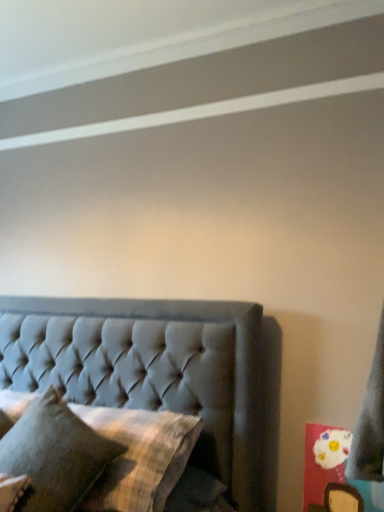
Question: From a real-world perspective, is plaid fabric pillow at center, arranged as the 1th pillow when ordered from the bottom, physically located above or below textured gray pillow at lower left, the second pillow positioned from the bottom?

Choices:
 (A) above
 (B) below

Answer: (B)

Question: Considering the positions of plaid fabric pillow at center, positioned as the second pillow in top-to-bottom order, and textured gray pillow at lower left, which appears as the first pillow when viewed from the top, in the image, is plaid fabric pillow at center, positioned as the second pillow in top-to-bottom order, taller or shorter than textured gray pillow at lower left, which appears as the first pillow when viewed from the top,?

Choices:
 (A) short
 (B) tall

Answer: (A)

Question: Based on their relative distances, which object is farther from the plaid fabric pillow at center, positioned as the second pillow in top-to-bottom order?

Choices:
 (A) textured gray pillow at lower left, the second pillow positioned from the bottom
 (B) tufted fabric bed at center

Answer: (B)

Question: Based on their relative distances, which object is farther from the textured gray pillow at lower left, which appears as the first pillow when viewed from the top?

Choices:
 (A) tufted fabric bed at center
 (B) plaid fabric pillow at center, positioned as the second pillow in top-to-bottom order

Answer: (A)